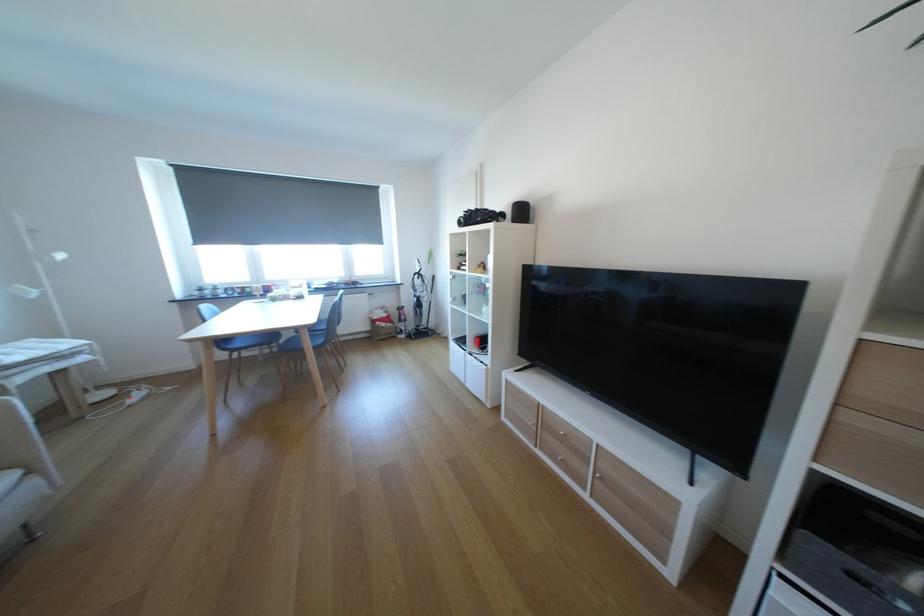
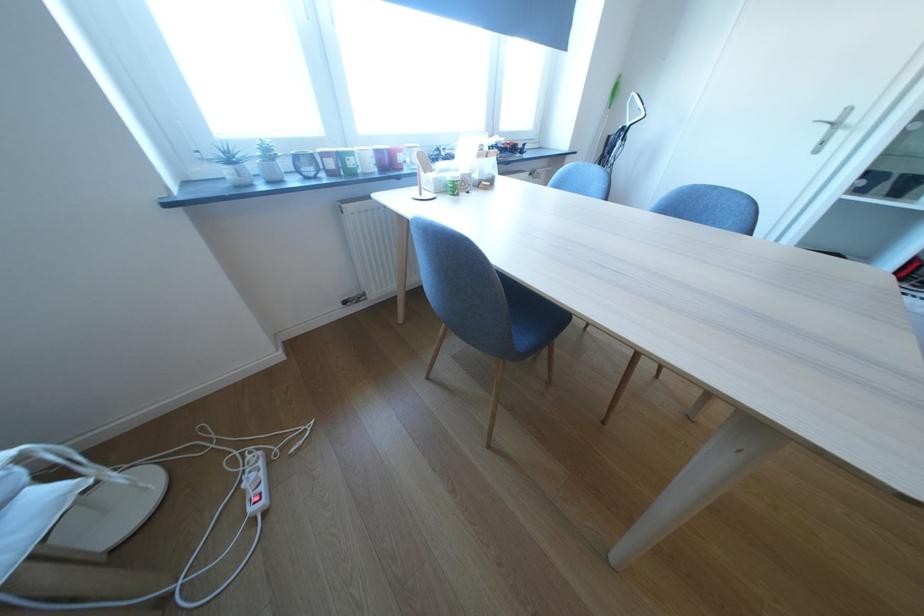
Locate, in the second image, the point that corresponds to the point at 249,292 in the first image.

(342, 164)